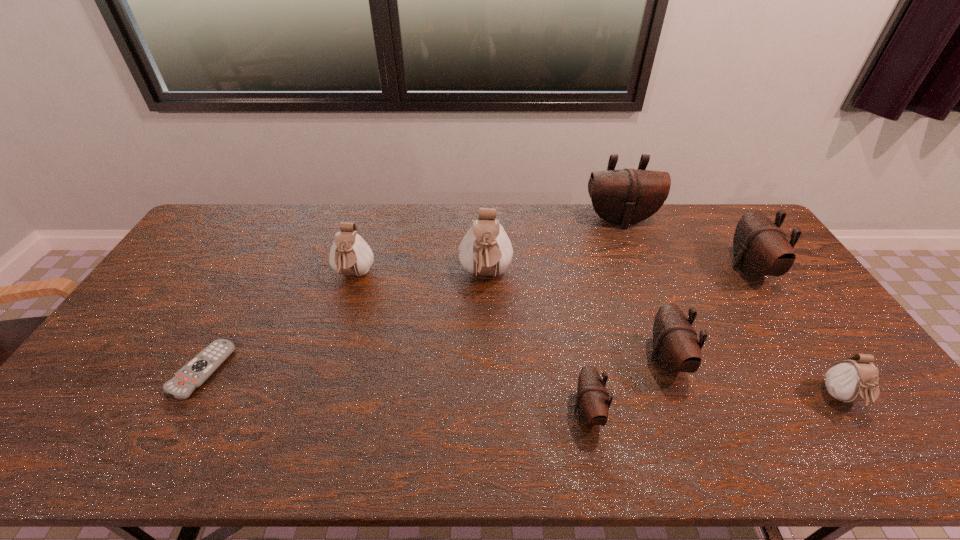
This screenshot has width=960, height=540. Identify the location of the farthest object. (624, 197).

The height and width of the screenshot is (540, 960). What are the coordinates of `the farthest brown pouch` in the screenshot? It's located at (624, 197).

Where is `the third object from left to right`? This screenshot has height=540, width=960. the third object from left to right is located at coordinates (485, 250).

What are the coordinates of `the sixth pouch from right to left` in the screenshot? It's located at (485, 250).

Where is `the second biggest brown pouch`? the second biggest brown pouch is located at coordinates (760, 248).

Locate an element on the screen. This screenshot has height=540, width=960. the third nearest brown pouch is located at coordinates (760, 248).

You are a GUI agent. You are given a task and a screenshot of the screen. Output one action in this format:
    pyautogui.click(x=<x>, y=<y>)
    Task: Click on the second object from left to right
    This screenshot has height=540, width=960.
    Given the screenshot: What is the action you would take?
    pyautogui.click(x=350, y=255)

Find the location of a particular element. This screenshot has height=540, width=960. the leftmost pouch is located at coordinates (350, 255).

You are a GUI agent. You are given a task and a screenshot of the screen. Output one action in this format:
    pyautogui.click(x=<x>, y=<y>)
    Task: Click on the third biggest brown pouch
    The height and width of the screenshot is (540, 960).
    Given the screenshot: What is the action you would take?
    pyautogui.click(x=676, y=348)

At what (x,y) coordinates should I click in order to perform the action: click on the rightmost white pouch. Please return your answer as a coordinate pair (x, y). This screenshot has width=960, height=540. Looking at the image, I should click on (852, 380).